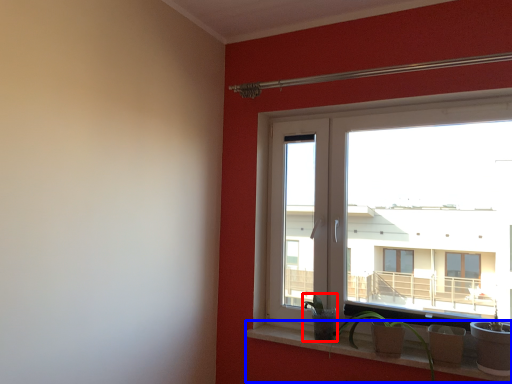
Question: Among these objects, which one is nearest to the camera, plant (highlighted by a red box) or window sill (highlighted by a blue box)?

Choices:
 (A) plant
 (B) window sill

Answer: (B)